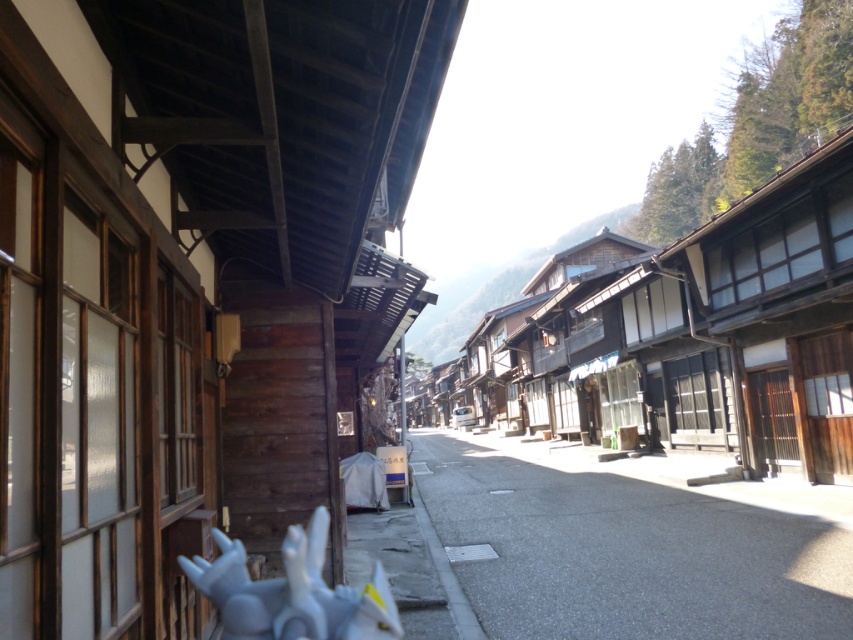
Does wooden buildings at center lie in front of smooth concrete street at center?

No.

Between point (764, 262) and point (712, 516), which one is positioned in front?

Positioned in front is point (712, 516).

You are a GUI agent. You are given a task and a screenshot of the screen. Output one action in this format:
    pyautogui.click(x=<x>, y=<y>)
    Task: Click on the wooden buildings at center
    
    Given the screenshot: What is the action you would take?
    pyautogui.click(x=688, y=333)

Is smooth concrete street at center to the right of white matte statue at lower center from the viewer's perspective?

Indeed, smooth concrete street at center is positioned on the right side of white matte statue at lower center.

Does point (532, 467) lie in front of point (373, 616)?

That is False.

Find the location of a particular element. The width and height of the screenshot is (853, 640). smooth concrete street at center is located at coordinates (624, 552).

Who is more distant from viewer, (770, 403) or (242, 627)?

Point (770, 403)

Is point (793, 230) in front of point (393, 604)?

No, (793, 230) is further to viewer.

At what (x,y) coordinates should I click in order to perform the action: click on wooden buildings at center. Please return your answer as a coordinate pair (x, y). Looking at the image, I should click on (688, 333).